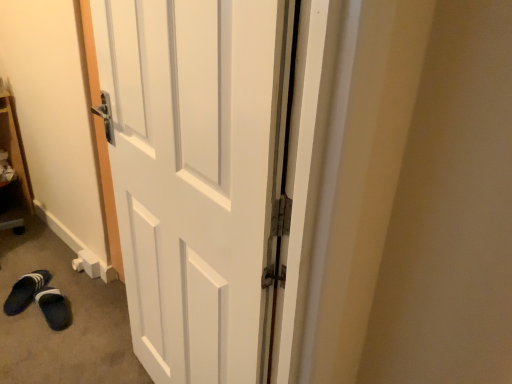
Question: Is dark blue fabric slippers at lower left, the second footwear viewed from the left, bigger than white matte door at center?

Choices:
 (A) no
 (B) yes

Answer: (A)

Question: Would you consider dark blue fabric slippers at lower left, the second footwear viewed from the left, to be distant from white matte door at center?

Choices:
 (A) yes
 (B) no

Answer: (A)

Question: Considering the relative sizes of dark blue fabric slippers at lower left, the first footwear in the right-to-left sequence, and white matte door at center in the image provided, is dark blue fabric slippers at lower left, the first footwear in the right-to-left sequence, taller than white matte door at center?

Choices:
 (A) yes
 (B) no

Answer: (B)

Question: From the image's perspective, is dark blue fabric slippers at lower left, the first footwear in the right-to-left sequence, beneath white matte door at center?

Choices:
 (A) yes
 (B) no

Answer: (A)

Question: Could you tell me if dark blue fabric slippers at lower left, the second footwear viewed from the left, is facing white matte door at center?

Choices:
 (A) no
 (B) yes

Answer: (A)

Question: Does dark blue fabric slippers at lower left, the first footwear in the right-to-left sequence, appear on the right side of white matte door at center?

Choices:
 (A) no
 (B) yes

Answer: (A)

Question: Is dark blue fabric slippers at lower left, the first footwear in the right-to-left sequence, oriented away from black fabric slipper at lower left, placed as the 1th footwear when sorted from left to right?

Choices:
 (A) no
 (B) yes

Answer: (B)

Question: Is black fabric slipper at lower left, arranged as the 2th footwear when viewed from the right, completely or partially inside dark blue fabric slippers at lower left, the second footwear viewed from the left?

Choices:
 (A) no
 (B) yes

Answer: (A)

Question: Can you confirm if dark blue fabric slippers at lower left, the first footwear in the right-to-left sequence, is shorter than black fabric slipper at lower left, placed as the 1th footwear when sorted from left to right?

Choices:
 (A) no
 (B) yes

Answer: (B)

Question: Does dark blue fabric slippers at lower left, the first footwear in the right-to-left sequence, have a smaller size compared to black fabric slipper at lower left, placed as the 1th footwear when sorted from left to right?

Choices:
 (A) no
 (B) yes

Answer: (B)

Question: Does dark blue fabric slippers at lower left, the second footwear viewed from the left, come in front of black fabric slipper at lower left, arranged as the 2th footwear when viewed from the right?

Choices:
 (A) no
 (B) yes

Answer: (B)

Question: Can you confirm if dark blue fabric slippers at lower left, the first footwear in the right-to-left sequence, is taller than black fabric slipper at lower left, placed as the 1th footwear when sorted from left to right?

Choices:
 (A) yes
 (B) no

Answer: (B)

Question: From a real-world perspective, is black fabric slipper at lower left, arranged as the 2th footwear when viewed from the right, over dark blue fabric slippers at lower left, the first footwear in the right-to-left sequence?

Choices:
 (A) yes
 (B) no

Answer: (A)